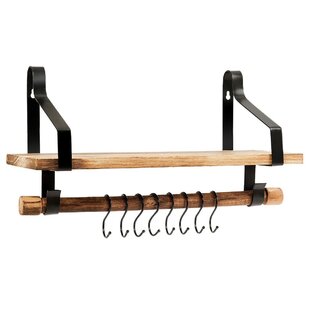
Find the location of a particular element. This screenshot has height=310, width=310. the 5th black hook is located at coordinates (167, 234).